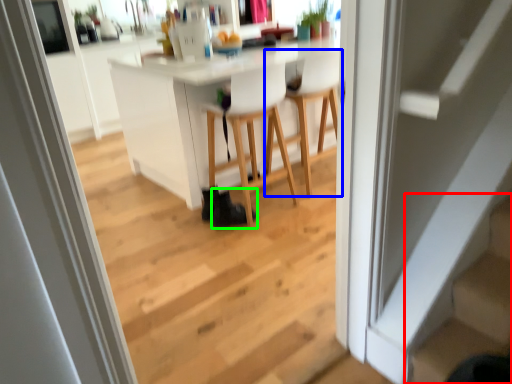
Question: Which object is positioned closest to stairs (highlighted by a red box)? Select from chair (highlighted by a blue box) and shoe (highlighted by a green box).

Choices:
 (A) chair
 (B) shoe

Answer: (B)